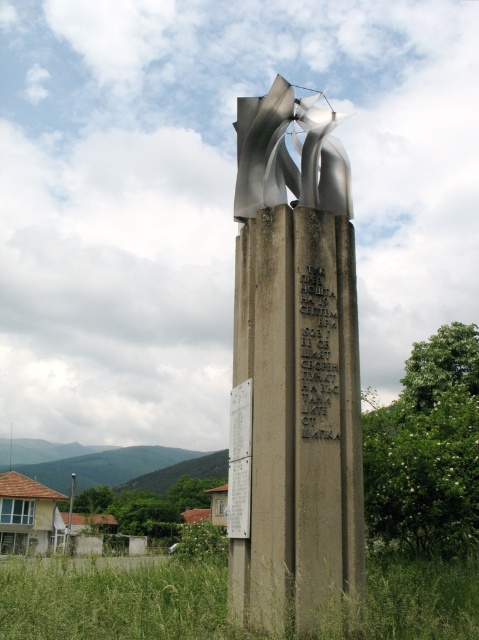
Between black stone inscription at center and white paper at center, which one appears on the right side from the viewer's perspective?

black stone inscription at center

Does black stone inscription at center appear on the left side of white paper at center?

In fact, black stone inscription at center is to the right of white paper at center.

Does point (324, 323) come behind point (240, 451)?

Yes, it is behind point (240, 451).

The image size is (479, 640). Find the location of `black stone inscription at center`. black stone inscription at center is located at coordinates (318, 355).

From the picture: Does shiny metallic sculpture at center appear on the left side of white paper at center?

Yes, shiny metallic sculpture at center is to the left of white paper at center.

Measure the distance from shiny metallic sculpture at center to white paper at center.

A distance of 3.42 meters exists between shiny metallic sculpture at center and white paper at center.

You are a GUI agent. You are given a task and a screenshot of the screen. Output one action in this format:
    pyautogui.click(x=<x>, y=<y>)
    Task: Click on the shiny metallic sculpture at center
    
    Given the screenshot: What is the action you would take?
    pyautogui.click(x=288, y=154)

Can you confirm if metallic silver sculpture at center is thinner than shiny metallic sculpture at center?

Yes.

Does metallic silver sculpture at center appear over shiny metallic sculpture at center?

No, metallic silver sculpture at center is not above shiny metallic sculpture at center.

Is point (298, 401) more distant than point (311, 108)?

No.

The height and width of the screenshot is (640, 479). I want to click on metallic silver sculpture at center, so click(294, 371).